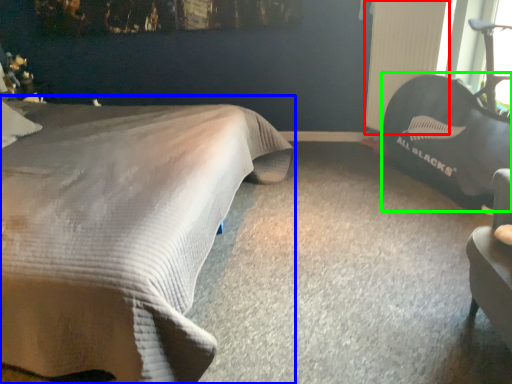
Question: Which is nearer to the radiator (highlighted by a red box)? bed (highlighted by a blue box) or bean bag chair (highlighted by a green box).

Choices:
 (A) bed
 (B) bean bag chair

Answer: (B)